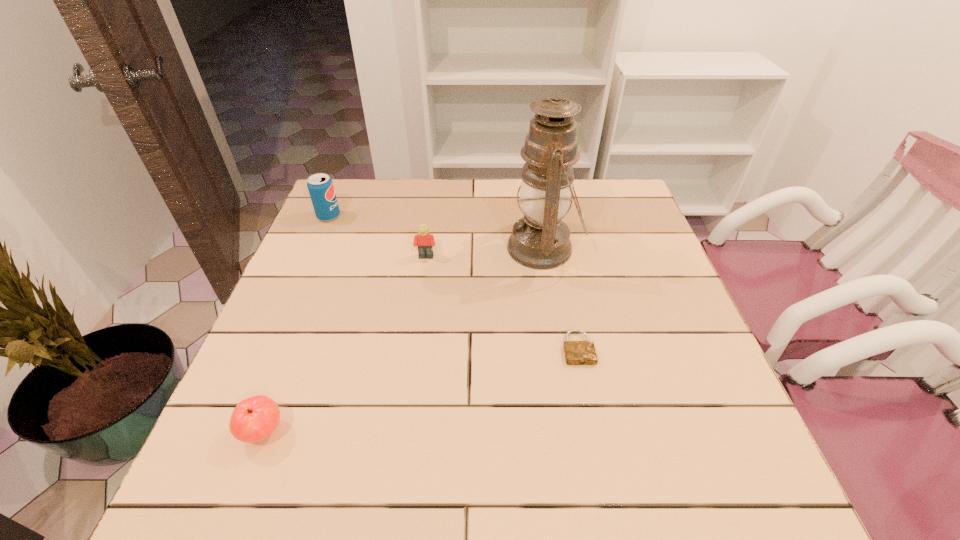
Locate an element on the screen. oil lamp is located at coordinates (540, 240).

Find the location of a particular element. The image size is (960, 540). soda can is located at coordinates (320, 186).

Where is `Lego`? The image size is (960, 540). Lego is located at coordinates (425, 241).

Image resolution: width=960 pixels, height=540 pixels. What are the coordinates of `apple` in the screenshot? It's located at (255, 418).

Locate an element on the screen. This screenshot has width=960, height=540. the nearest object is located at coordinates (255, 418).

Image resolution: width=960 pixels, height=540 pixels. Identify the location of the fourth farthest object. (576, 352).

I want to click on padlock, so click(x=576, y=352).

Identify the location of vacant region located on the right of the oil lamp. (637, 248).

Image resolution: width=960 pixels, height=540 pixels. I want to click on vacant area situated 0.340m on the right of the soda can, so click(454, 217).

In order to click on vacant space situated on the face of the Lego in this screenshot , I will do `click(419, 309)`.